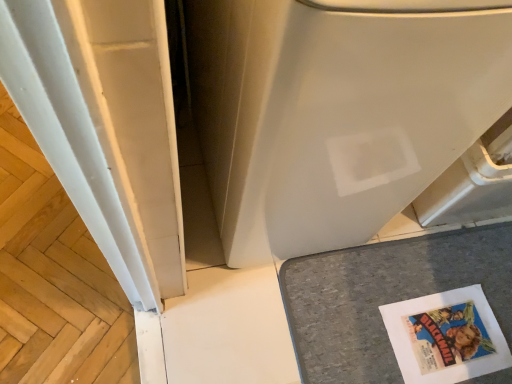
This screenshot has height=384, width=512. What do you see at coordinates (337, 111) in the screenshot? I see `white matte water heater at center` at bounding box center [337, 111].

Identify the location of white matte water heater at center. (337, 111).

Is white matte water heater at center oriented away from gray felt mat at lower right?

No.

From the image's perspective, is white matte water heater at center above or below gray felt mat at lower right?

Based on their image positions, white matte water heater at center is located above gray felt mat at lower right.

Does white matte water heater at center have a lesser width compared to gray felt mat at lower right?

Incorrect, the width of white matte water heater at center is not less than that of gray felt mat at lower right.

Does white matte water heater at center come in front of white smooth wood at left?

Yes, it is.

This screenshot has height=384, width=512. I want to click on water heater above the white smooth wood at left (from the image's perspective), so (x=337, y=111).

Is white matte water heater at center next to white smooth wood at left?

No, white matte water heater at center is not in contact with white smooth wood at left.

From a real-world perspective, is white matte water heater at center positioned under white smooth wood at left based on gravity?

No, from a real-world perspective, white matte water heater at center is not under white smooth wood at left.

Is gray felt mat at lower right taller or shorter than white matte water heater at center?

In the image, gray felt mat at lower right appears to be shorter than white matte water heater at center.

From the image's perspective, does gray felt mat at lower right appear higher than white matte water heater at center?

Actually, gray felt mat at lower right appears below white matte water heater at center in the image.

How distant is gray felt mat at lower right from white matte water heater at center?

gray felt mat at lower right is 42.86 centimeters from white matte water heater at center.

Is gray felt mat at lower right inside the boundaries of white matte water heater at center, or outside?

gray felt mat at lower right cannot be found inside white matte water heater at center.

Which point is more distant from viewer, (364, 344) or (90, 339)?

Positioned behind is point (364, 344).

Which object is wider, gray felt mat at lower right or white smooth wood at left?

gray felt mat at lower right.

From a real-world perspective, is gray felt mat at lower right positioned over white smooth wood at left based on gravity?

→ Yes, from a real-world perspective, gray felt mat at lower right is over white smooth wood at left

From the image's perspective, is gray felt mat at lower right located above or below white smooth wood at left?

gray felt mat at lower right is below white smooth wood at left.

This screenshot has width=512, height=384. I want to click on wood on the left of the gray felt mat at lower right, so click(53, 278).

Considering the sizes of white smooth wood at left and gray felt mat at lower right in the image, is white smooth wood at left taller or shorter than gray felt mat at lower right?

white smooth wood at left is shorter than gray felt mat at lower right.

Would you say white smooth wood at left is inside or outside gray felt mat at lower right?

white smooth wood at left is not inside gray felt mat at lower right, it's outside.

From a real-world perspective, is white smooth wood at left below gray felt mat at lower right?

Yes.

Is the depth of white smooth wood at left less than that of white matte water heater at center?

No.

Locate an element on the screen. The width and height of the screenshot is (512, 384). wood on the left of white matte water heater at center is located at coordinates (53, 278).

Could you tell me if white smooth wood at left is turned towards white matte water heater at center?

No, white smooth wood at left is not oriented towards white matte water heater at center.

Is white smooth wood at left thinner than white matte water heater at center?

Indeed, white smooth wood at left has a lesser width compared to white matte water heater at center.

Locate an element on the screen. The height and width of the screenshot is (384, 512). counter top lying below the white matte water heater at center (from the image's perspective) is located at coordinates (385, 296).

The image size is (512, 384). In order to click on wood on the left of white matte water heater at center in this screenshot , I will do `click(53, 278)`.

Looking at the image, which one is located further to white smooth wood at left, gray felt mat at lower right or white matte water heater at center?

gray felt mat at lower right is further to white smooth wood at left.

Consider the image. Estimate the real-world distances between objects in this image. Which object is closer to gray felt mat at lower right, white smooth wood at left or white matte water heater at center?

Based on the image, white matte water heater at center appears to be nearer to gray felt mat at lower right.

From the image, which object appears to be farther from white matte water heater at center, white smooth wood at left or gray felt mat at lower right?

The object further to white matte water heater at center is white smooth wood at left.

From the image, which object appears to be farther from white smooth wood at left, white matte water heater at center or gray felt mat at lower right?

gray felt mat at lower right lies further to white smooth wood at left than the other object.

Considering their positions, is white matte water heater at center positioned closer to gray felt mat at lower right than white smooth wood at left?

white matte water heater at center.

Which object lies nearer to the anchor point white matte water heater at center, gray felt mat at lower right or white smooth wood at left?

Based on the image, gray felt mat at lower right appears to be nearer to white matte water heater at center.

In order to click on water heater between white smooth wood at left and gray felt mat at lower right from left to right in this screenshot , I will do `click(337, 111)`.